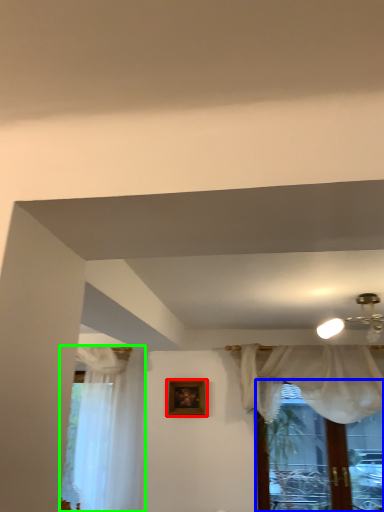
Question: Which is nearer to the picture frame (highlighted by a red box)? window (highlighted by a blue box) or curtain (highlighted by a green box).

Choices:
 (A) window
 (B) curtain

Answer: (B)